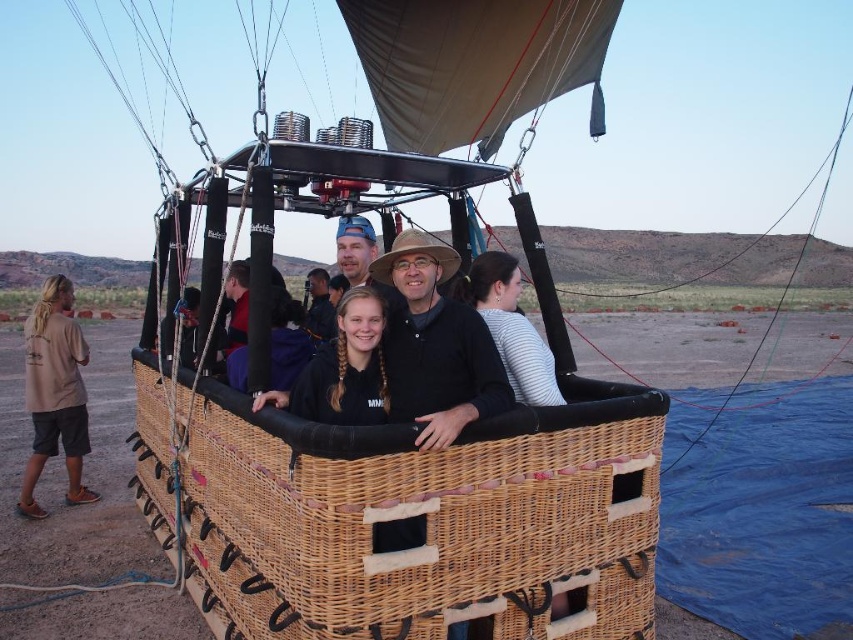
How far apart are woven wicker basket at center and beige cotton shirt at left?

woven wicker basket at center is 15.14 feet away from beige cotton shirt at left.

Which is in front, point (212, 580) or point (74, 369)?

Point (212, 580) is in front.

Who is more distant from viewer, (x=318, y=524) or (x=88, y=448)?

Positioned behind is point (x=88, y=448).

Image resolution: width=853 pixels, height=640 pixels. Find the location of `woven wicker basket at center`. woven wicker basket at center is located at coordinates (427, 518).

Between woven wicker basket at center and black fleece jacket at center, which one appears on the right side from the viewer's perspective?

Positioned to the right is black fleece jacket at center.

Does woven wicker basket at center lie behind black fleece jacket at center?

That is False.

Is point (260, 472) in front of point (305, 390)?

That is True.

Identify the location of woven wicker basket at center. This screenshot has height=640, width=853. (427, 518).

How distant is black fleece jacket at center from white striped shirt at center?

black fleece jacket at center and white striped shirt at center are 97.85 centimeters apart.

Is black fleece jacket at center above white striped shirt at center?

No.

Does point (305, 365) come behind point (467, 276)?

No, (305, 365) is closer to viewer.

Find the location of a particular element. The image size is (853, 640). black fleece jacket at center is located at coordinates (347, 368).